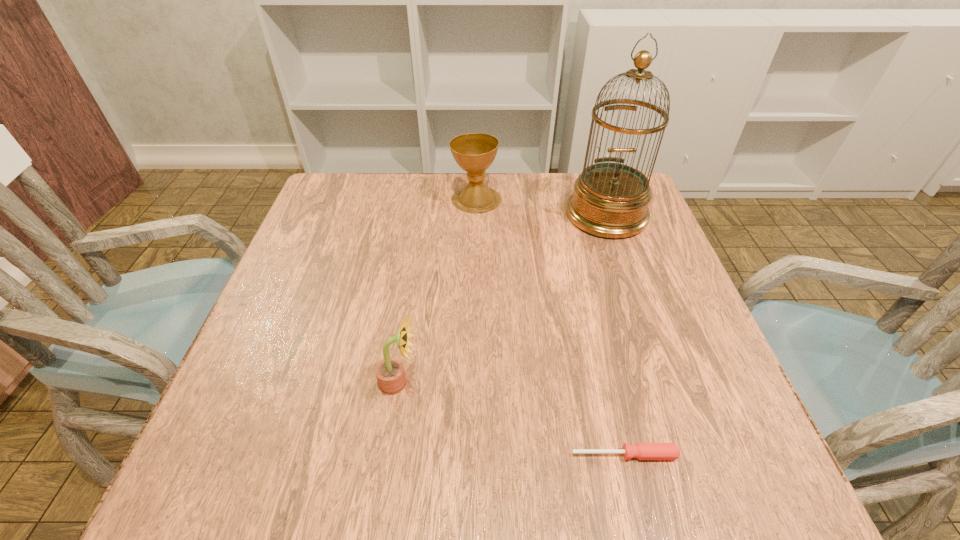
Where is `birdcage`? birdcage is located at coordinates (610, 200).

At what (x,y) coordinates should I click in order to perform the action: click on chalice. Please return your answer as a coordinate pair (x, y). The image size is (960, 540). Looking at the image, I should click on (474, 152).

Find the location of a particular element. The height and width of the screenshot is (540, 960). sunflower is located at coordinates (390, 373).

Find the location of `the leftmost object`. the leftmost object is located at coordinates (390, 373).

This screenshot has height=540, width=960. I want to click on the shortest object, so click(643, 451).

At what (x,y) coordinates should I click in order to perform the action: click on screwdriver. Please return your answer as a coordinate pair (x, y). Image resolution: width=960 pixels, height=540 pixels. Looking at the image, I should click on (643, 451).

Locate an element on the screen. The image size is (960, 540). free point located with an open door on the tallest object is located at coordinates (648, 334).

The width and height of the screenshot is (960, 540). I want to click on free space located 0.130m on the left of the chalice, so click(403, 199).

I want to click on vacant space located on the face of the third farthest object, so click(464, 383).

Locate an element on the screen. vacant space situated 0.210m on the left of the shortest object is located at coordinates (439, 455).